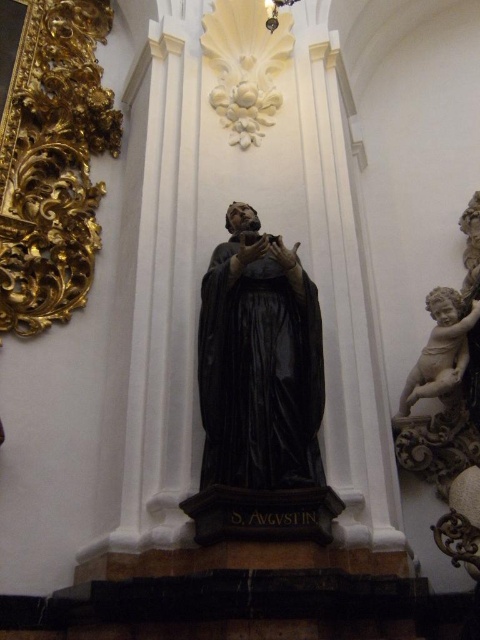
Question: Which of the following is the farthest from the observer?

Choices:
 (A) (263, 376)
 (B) (443, 326)

Answer: (B)

Question: Observing the image, what is the correct spatial positioning of black polished statue at center in reference to white marble cherub at right?

Choices:
 (A) left
 (B) right

Answer: (A)

Question: Can you confirm if black polished statue at center is wider than white marble cherub at right?

Choices:
 (A) no
 (B) yes

Answer: (B)

Question: Does black polished statue at center come in front of white marble cherub at right?

Choices:
 (A) no
 (B) yes

Answer: (B)

Question: Which object appears closest to the camera in this image?

Choices:
 (A) black polished statue at center
 (B) white marble cherub at right

Answer: (A)